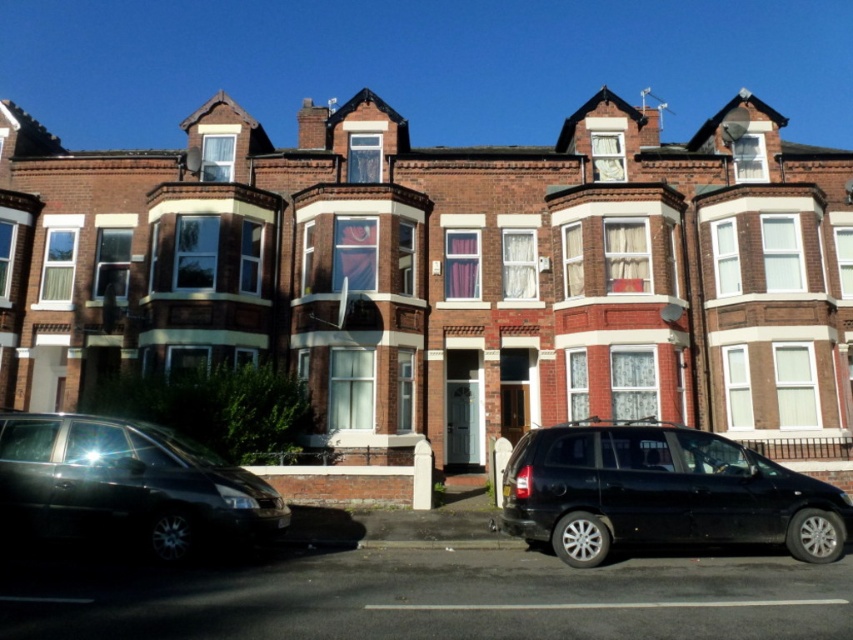
Can you confirm if black matte van at center is positioned to the right of shiny black car at lower left?

Indeed, black matte van at center is positioned on the right side of shiny black car at lower left.

Can you confirm if black matte van at center is smaller than shiny black car at lower left?

Actually, black matte van at center might be larger than shiny black car at lower left.

In order to click on black matte van at center in this screenshot , I will do `click(662, 493)`.